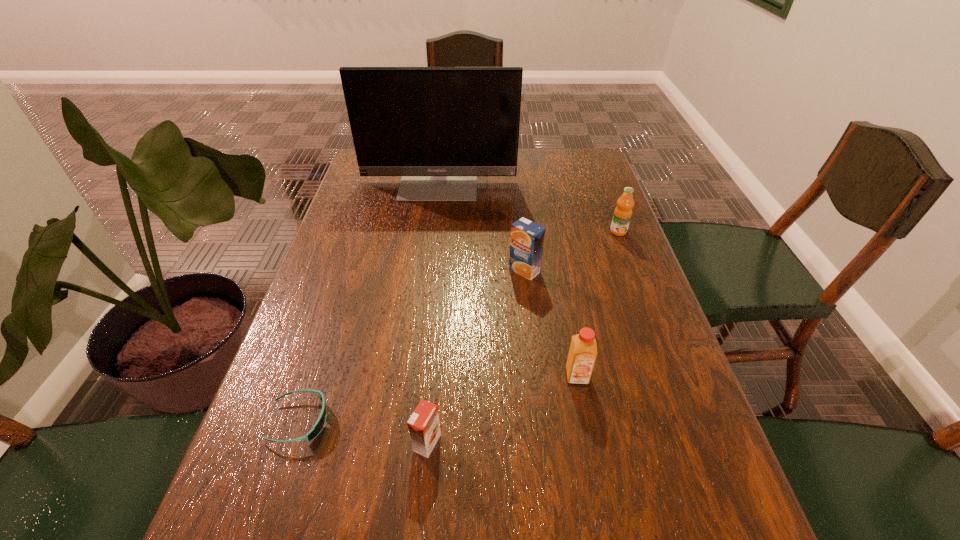
Identify the location of the shortest object. This screenshot has height=540, width=960. (319, 425).

I want to click on free point located on the screen of the farthest object, so click(x=428, y=264).

Image resolution: width=960 pixels, height=540 pixels. What are the coordinates of `vacant position located on the front of the third nearest orange juice` in the screenshot? It's located at (540, 410).

Locate an element on the screen. The image size is (960, 540). free space located on the label of the rightmost orange juice is located at coordinates (644, 301).

The width and height of the screenshot is (960, 540). I want to click on vacant region located 0.170m on the front and back of the second nearest orange juice, so click(x=595, y=470).

Where is `free space located 0.280m on the back of the second shortest object`? The image size is (960, 540). free space located 0.280m on the back of the second shortest object is located at coordinates (439, 316).

I want to click on free space located on the front-facing side of the sunglasses, so click(x=372, y=421).

At what (x,y) coordinates should I click in order to perform the action: click on object that is at the far edge. Please return your answer as a coordinate pair (x, y). This screenshot has width=960, height=540. Looking at the image, I should click on (439, 128).

The width and height of the screenshot is (960, 540). Find the location of `computer monitor at the left edge`. computer monitor at the left edge is located at coordinates (439, 128).

Where is `sunglasses that is at the left edge`? This screenshot has height=540, width=960. sunglasses that is at the left edge is located at coordinates (319, 425).